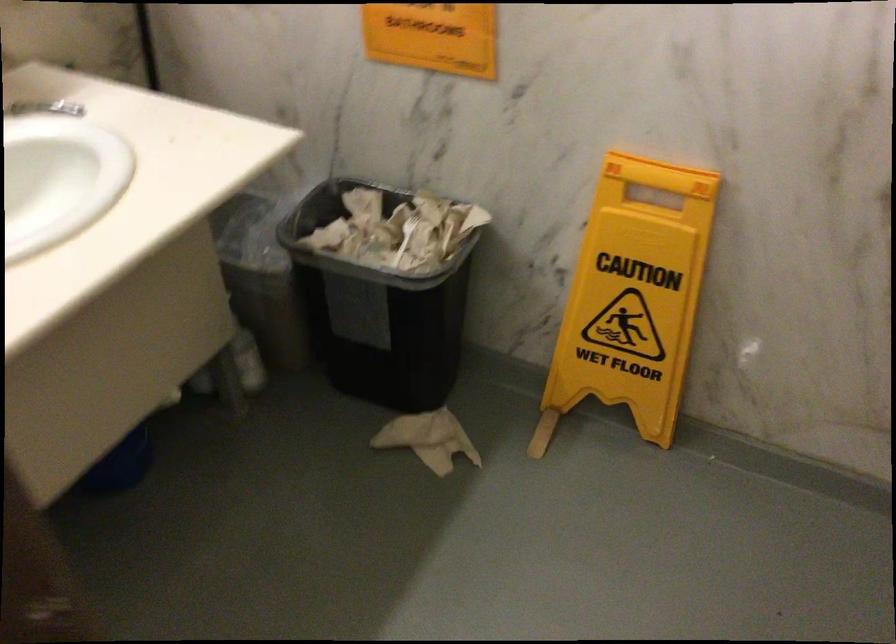
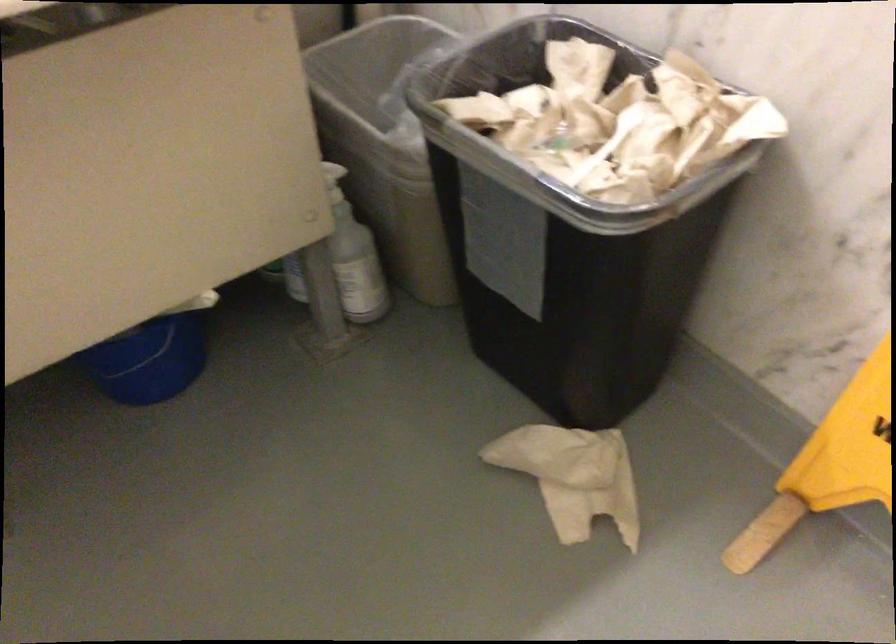
Locate, in the second image, the point that corresponds to [564,386] in the first image.

(830, 464)